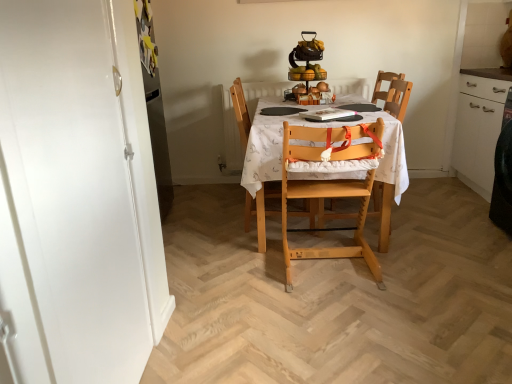
In order to click on vacant space positioned to the left of wooden chair with cushion at center, acting as the third chair starting from the right in this screenshot , I will do `click(214, 223)`.